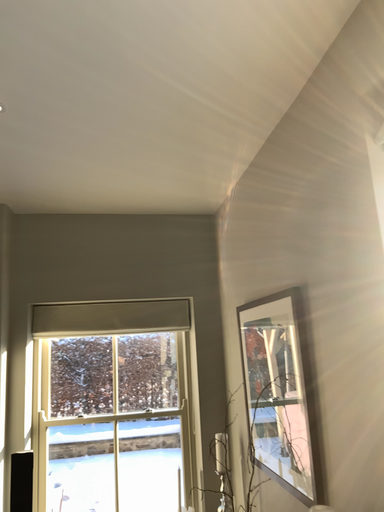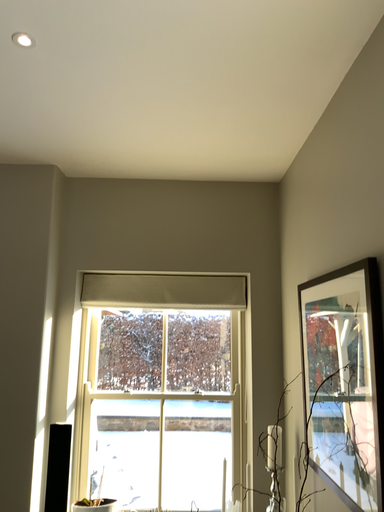
Question: How did the camera likely rotate when shooting the video?

Choices:
 (A) rotated left
 (B) rotated right

Answer: (A)